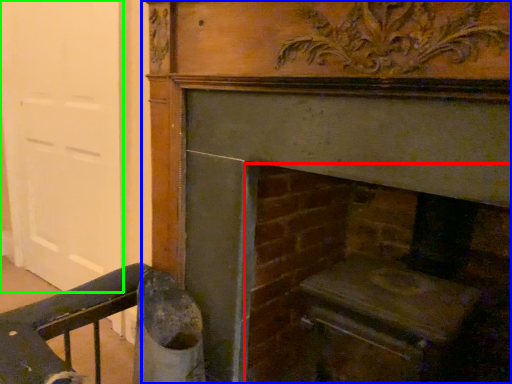
Question: Which object is the closest to the fireplace (highlighted by a red box)? Choose among these: fireplace (highlighted by a blue box) or door (highlighted by a green box).

Choices:
 (A) fireplace
 (B) door

Answer: (A)